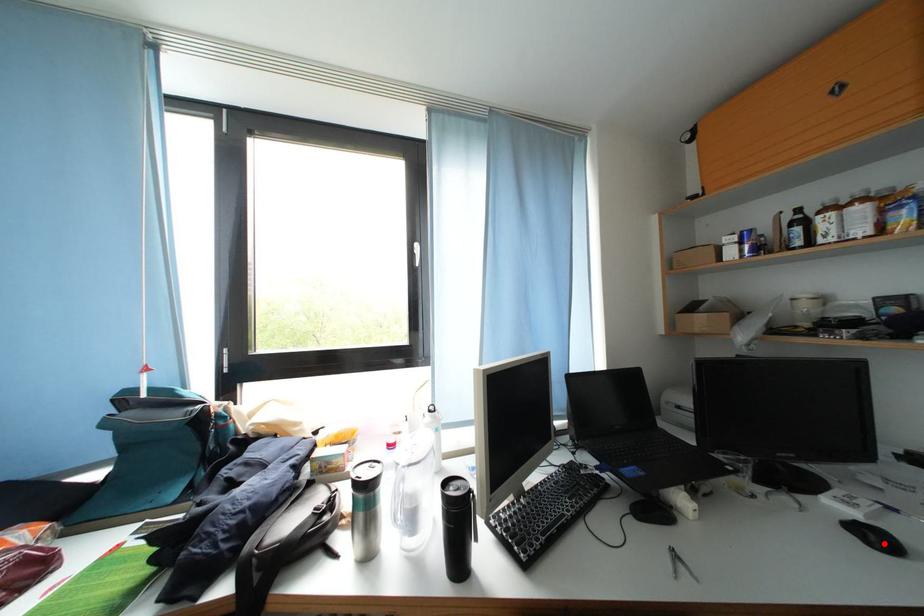
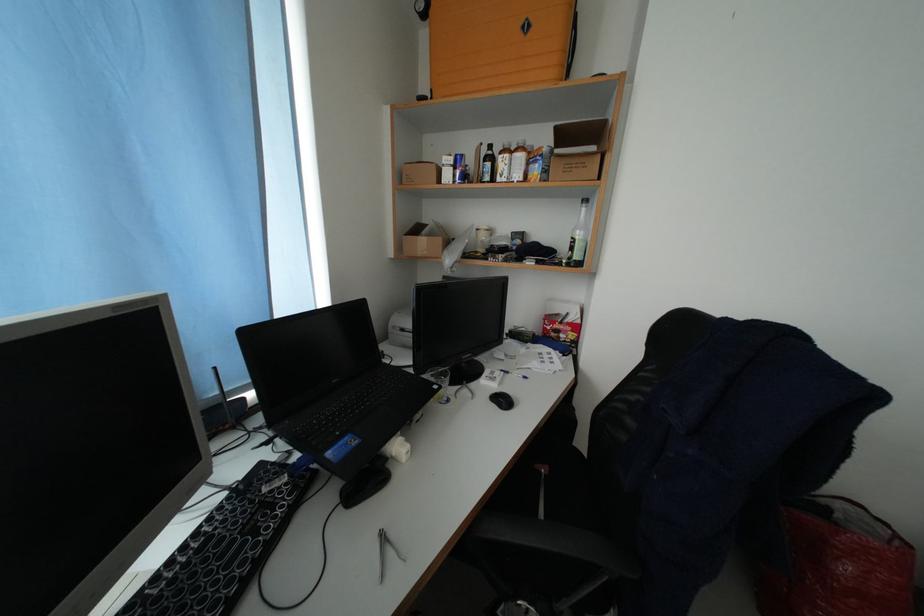
Locate, in the second image, the point that corresponds to the highlighted location in the first image.

(512, 406)